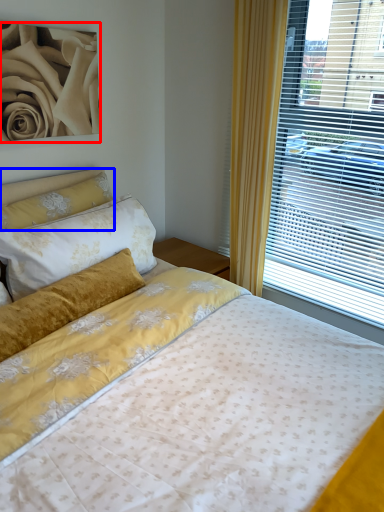
Question: Among these objects, which one is farthest to the camera, rose (highlighted by a red box) or pillow (highlighted by a blue box)?

Choices:
 (A) rose
 (B) pillow

Answer: (B)